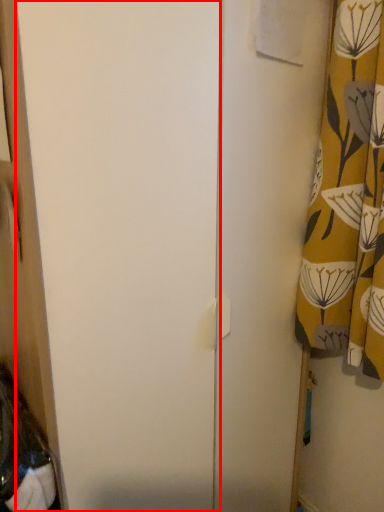
Question: From the image's perspective, where is screen door (annotated by the red box) located in relation to curtain in the image?

Choices:
 (A) above
 (B) below

Answer: (B)